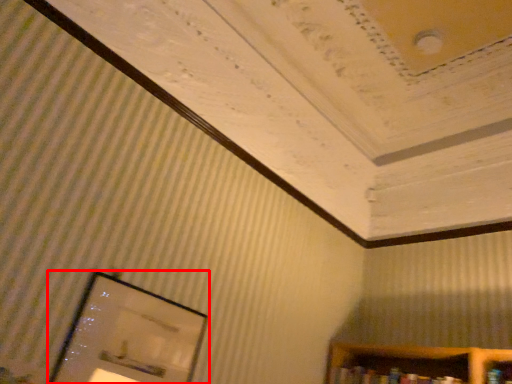
Question: From the image's perspective, considering the relative positions of picture frame (annotated by the red box) and book in the image provided, where is picture frame (annotated by the red box) located with respect to the staircase?

Choices:
 (A) above
 (B) below

Answer: (A)